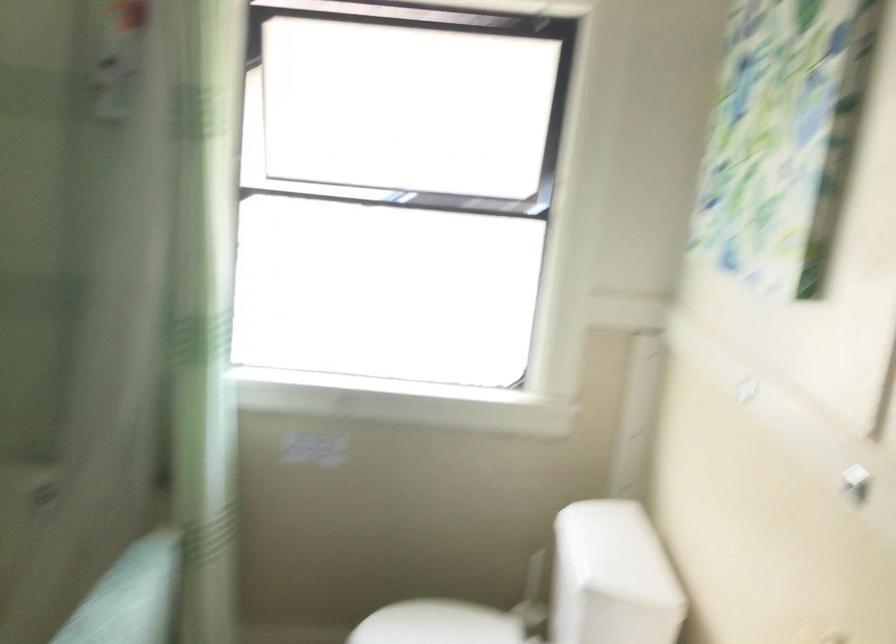
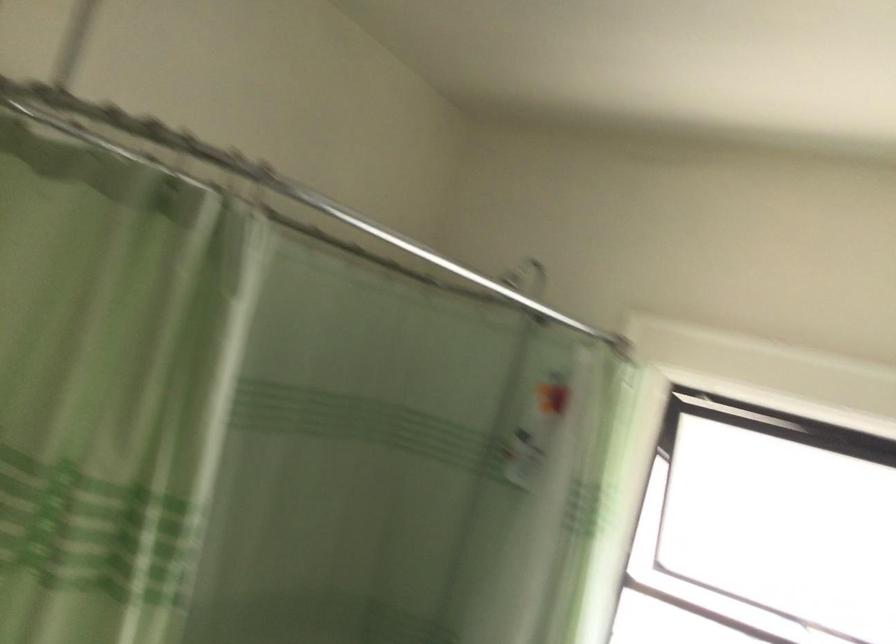
Based on the continuous images, in which direction is the camera rotating?

The camera rotated toward left-up.